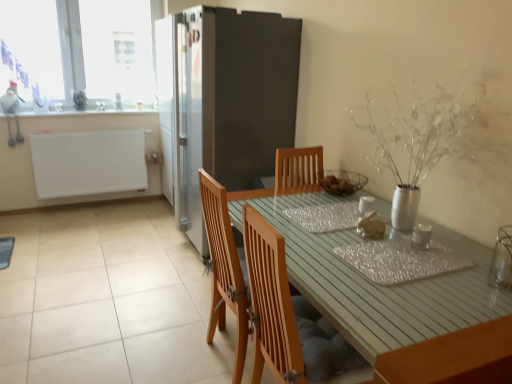
Question: Is shiny metallic placemat at center positioned with its back to white glossy counter top at upper left?

Choices:
 (A) no
 (B) yes

Answer: (A)

Question: Are shiny metallic placemat at center and white glossy counter top at upper left located far from each other?

Choices:
 (A) no
 (B) yes

Answer: (B)

Question: Considering the relative positions of shiny metallic placemat at center and white glossy counter top at upper left in the image provided, is shiny metallic placemat at center to the right of white glossy counter top at upper left from the viewer's perspective?

Choices:
 (A) no
 (B) yes

Answer: (B)

Question: From a real-world perspective, is shiny metallic placemat at center over white glossy counter top at upper left?

Choices:
 (A) no
 (B) yes

Answer: (A)

Question: Is shiny metallic placemat at center further to camera compared to white glossy counter top at upper left?

Choices:
 (A) no
 (B) yes

Answer: (A)

Question: From a real-world perspective, is matte gold bunny at center positioned above or below white matte radiator at left?

Choices:
 (A) above
 (B) below

Answer: (A)

Question: From the image's perspective, is matte gold bunny at center positioned above or below white matte radiator at left?

Choices:
 (A) below
 (B) above

Answer: (A)

Question: Is matte gold bunny at center bigger or smaller than white matte radiator at left?

Choices:
 (A) big
 (B) small

Answer: (B)

Question: Does point (362, 218) appear closer or farther from the camera than point (91, 132)?

Choices:
 (A) farther
 (B) closer

Answer: (B)

Question: Considering the positions of wooden chair at lower center, the 2th chair in the back-to-front sequence, and satin silver fridge at center in the image, is wooden chair at lower center, the 2th chair in the back-to-front sequence, taller or shorter than satin silver fridge at center?

Choices:
 (A) short
 (B) tall

Answer: (A)

Question: Considering their positions, is wooden chair at lower center, which is the first chair from front to back, located in front of or behind satin silver fridge at center?

Choices:
 (A) front
 (B) behind

Answer: (A)

Question: Which is correct: wooden chair at lower center, which is the first chair from front to back, is inside satin silver fridge at center, or outside of it?

Choices:
 (A) inside
 (B) outside

Answer: (B)

Question: Considering the relative positions of wooden chair at lower center, which is the first chair from front to back, and satin silver fridge at center in the image provided, is wooden chair at lower center, which is the first chair from front to back, to the left or to the right of satin silver fridge at center?

Choices:
 (A) left
 (B) right

Answer: (B)

Question: From the image's perspective, relative to wooden table at center, is transparent glass window at upper left above or below?

Choices:
 (A) below
 (B) above

Answer: (B)

Question: Is transparent glass window at upper left inside or outside of wooden table at center?

Choices:
 (A) outside
 (B) inside

Answer: (A)